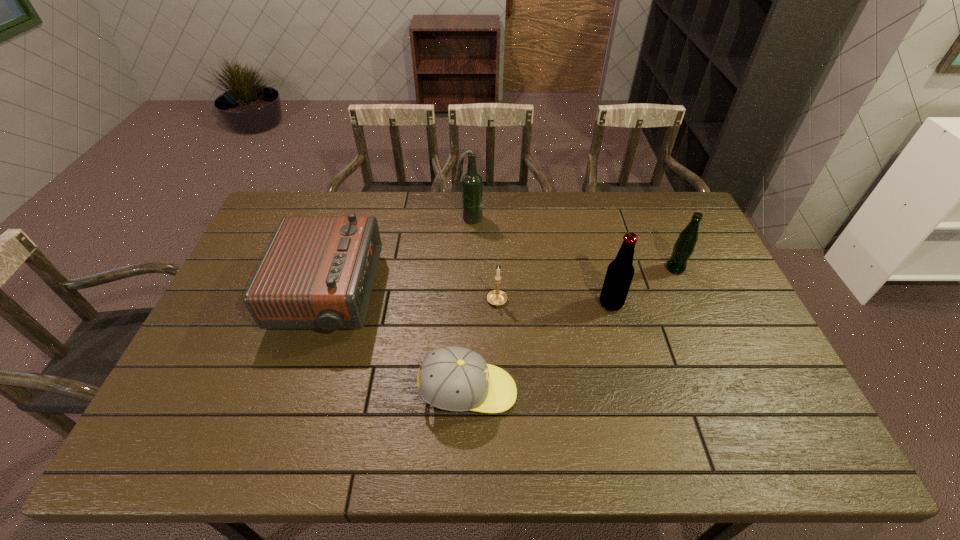
The image size is (960, 540). I want to click on free space between the nearest beer bottle and the candle holder, so click(554, 303).

What are the coordinates of `empty space between the candle holder and the nearest beer bottle` in the screenshot? It's located at click(x=554, y=303).

Where is `free spot between the second beer bottle from left to right and the baseball cap`? The width and height of the screenshot is (960, 540). free spot between the second beer bottle from left to right and the baseball cap is located at coordinates (540, 348).

Select which object is the fifth closest to the candle holder. Please provide its 2D coordinates. Your answer should be formatted as a tuple, i.e. [(x, y)], where the tuple contains the x and y coordinates of a point satisfying the conditions above.

[(684, 246)]

This screenshot has width=960, height=540. Find the location of `object that can be found as the fifth closest to the rightmost object`. object that can be found as the fifth closest to the rightmost object is located at coordinates (318, 272).

Select which beer bottle appears as the closest to the nearest object. Please provide its 2D coordinates. Your answer should be formatted as a tuple, i.e. [(x, y)], where the tuple contains the x and y coordinates of a point satisfying the conditions above.

[(620, 272)]

I want to click on beer bottle that stands as the second closest to the nearest object, so click(x=472, y=185).

You are a GUI agent. You are given a task and a screenshot of the screen. Output one action in this format:
    pyautogui.click(x=<x>, y=<y>)
    Task: Click on the blank area in the image that satisfies the following two spatial constraints: 1. on the front side of the rightmost object; 2. on the front panel of the radio receiver
    
    Given the screenshot: What is the action you would take?
    pyautogui.click(x=686, y=295)